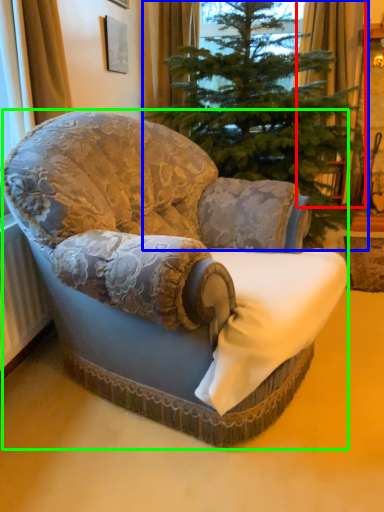
Question: Which object is the farthest from curtain (highlighted by a red box)? Choose among these: christmas tree (highlighted by a blue box) or chair (highlighted by a green box).

Choices:
 (A) christmas tree
 (B) chair

Answer: (B)